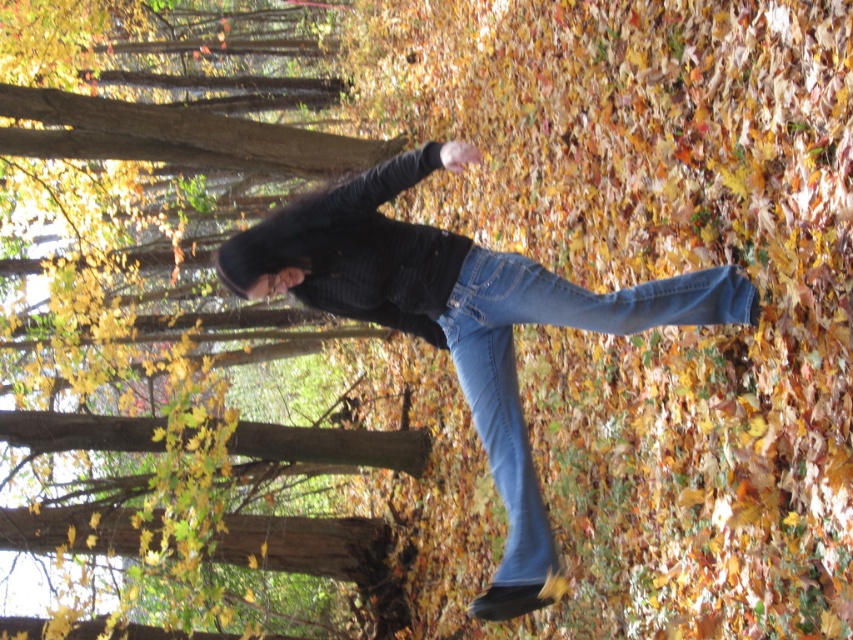
You are trying to find the denim jeans at center and the denim at center in the image. Which one is located to the left?

The denim jeans at center is to the left of denim at center.